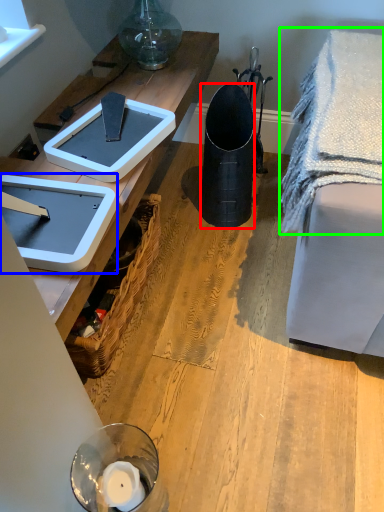
Question: Which object is the farthest from trash bin/can (highlighted by a red box)? Choose among these: weight scale (highlighted by a blue box) or blanket (highlighted by a green box).

Choices:
 (A) weight scale
 (B) blanket

Answer: (A)